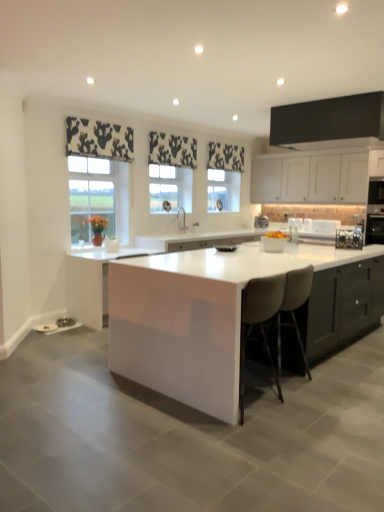
Locate an element on the screen. The width and height of the screenshot is (384, 512). black floral fabric at upper center, acting as the second curtain starting from the left is located at coordinates (172, 150).

Find the location of a particular element. The image size is (384, 512). white matte cabinet at upper right, marked as the second cabinetry in a top-to-bottom arrangement is located at coordinates (310, 178).

Describe the element at coordinates (310, 178) in the screenshot. I see `white matte cabinet at upper right, which appears as the 3th cabinetry when viewed from the front` at that location.

Describe the element at coordinates (294, 308) in the screenshot. Image resolution: width=384 pixels, height=512 pixels. I see `beige fabric stool at center` at that location.

Locate an element on the screen. clear glass window at center, the first window positioned from the right is located at coordinates (223, 191).

This screenshot has width=384, height=512. What do you see at coordinates (223, 191) in the screenshot?
I see `clear glass window at center, which is the 2th window from left to right` at bounding box center [223, 191].

Find the location of a particular element. The image size is (384, 512). white glossy coffee machine at center is located at coordinates (261, 221).

Is white glossy cabinet at center, which is the 3th cabinetry from top to bottom, positioned far away from white matte cabinet at upper right, which is the 2th cabinetry from bottom to top?

white glossy cabinet at center, which is the 3th cabinetry from top to bottom, is far away from white matte cabinet at upper right, which is the 2th cabinetry from bottom to top.

Who is smaller, white glossy cabinet at center, positioned as the third cabinetry in right-to-left order, or white matte cabinet at upper right, arranged as the first cabinetry when viewed from the right?

white glossy cabinet at center, positioned as the third cabinetry in right-to-left order, is smaller.

Considering the sizes of objects white glossy cabinet at center, which ranks as the first cabinetry in bottom-to-top order, and white matte cabinet at upper right, which appears as the third cabinetry when viewed from the left, in the image provided, who is thinner, white glossy cabinet at center, which ranks as the first cabinetry in bottom-to-top order, or white matte cabinet at upper right, which appears as the third cabinetry when viewed from the left,?

white matte cabinet at upper right, which appears as the third cabinetry when viewed from the left.

You are a GUI agent. You are given a task and a screenshot of the screen. Output one action in this format:
    pyautogui.click(x=<x>, y=<y>)
    Task: Click on the 1st cabinetry directly above the white glossy cabinet at center, which is the second cabinetry from back to front (from a real-world perspective)
    The image size is (384, 512).
    Given the screenshot: What is the action you would take?
    pyautogui.click(x=310, y=178)

Visually, is white glossy bowl at center positioned to the left or to the right of white glossy table at center?

white glossy bowl at center is positioned on white glossy table at center's left side.

Is white glossy bowl at center looking in the opposite direction of white glossy table at center?

That's not correct — white glossy bowl at center is not looking away from white glossy table at center.

Looking at this image, measure the distance from white glossy bowl at center to white glossy table at center.

white glossy bowl at center and white glossy table at center are 9.43 feet apart from each other.

Which of these two, white glossy bowl at center or white glossy table at center, is smaller?

With smaller size is white glossy bowl at center.

Between black stainless steel oven at right, acting as the 1th appliance starting from the back, and black glossy pan at center, the 3th appliance from the right, which one appears on the right side from the viewer's perspective?

Positioned to the right is black stainless steel oven at right, acting as the 1th appliance starting from the back.

Can you confirm if black stainless steel oven at right, acting as the 1th appliance starting from the back, is thinner than black glossy pan at center, which ranks as the third appliance in back-to-front order?

Incorrect, the width of black stainless steel oven at right, acting as the 1th appliance starting from the back, is not less than that of black glossy pan at center, which ranks as the third appliance in back-to-front order.

How far apart are black stainless steel oven at right, arranged as the third appliance when viewed from the left, and black glossy pan at center, the first appliance from the front?

black stainless steel oven at right, arranged as the third appliance when viewed from the left, is 5.91 feet from black glossy pan at center, the first appliance from the front.

Who is shorter, black stainless steel oven at right, the 3th appliance when ordered from front to back, or black glossy pan at center, the first appliance from the front?

Standing shorter between the two is black glossy pan at center, the first appliance from the front.

How different are the orientations of white glossy sink at center and white matte cabinet at upper right, marked as the first cabinetry in a back-to-front arrangement, in degrees?

92.9 degrees.

Which object is more forward, white glossy sink at center or white matte cabinet at upper right, which appears as the third cabinetry when viewed from the left?

white glossy sink at center.

Which is more to the right, white glossy sink at center or white matte cabinet at upper right, marked as the first cabinetry in a back-to-front arrangement?

white matte cabinet at upper right, marked as the first cabinetry in a back-to-front arrangement.

Can white matte cabinet at upper right, arranged as the first cabinetry when viewed from the right, be found inside white glossy sink at center?

No, white glossy sink at center does not contain white matte cabinet at upper right, arranged as the first cabinetry when viewed from the right.

Is white matte cabinet at upper right, marked as the second cabinetry in a top-to-bottom arrangement, placed right next to black floral fabric at upper center, positioned as the 2th curtain in back-to-front order?

They are not placed beside each other.

Considering the relative sizes of white matte cabinet at upper right, marked as the first cabinetry in a back-to-front arrangement, and black floral fabric at upper center, marked as the second curtain in a right-to-left arrangement, in the image provided, is white matte cabinet at upper right, marked as the first cabinetry in a back-to-front arrangement, shorter than black floral fabric at upper center, marked as the second curtain in a right-to-left arrangement,?

No.

How many degrees apart are the facing directions of white matte cabinet at upper right, arranged as the first cabinetry when viewed from the right, and black floral fabric at upper center, which is the second curtain in front-to-back order?

They differ by 89.3 degrees in their facing directions.

In the image, there is a clear glass window at center, the first window positioned from the back. Where is `sink below it (from a real-world perspective)`? sink below it (from a real-world perspective) is located at coordinates (183, 220).

Who is taller, clear glass window at center, the 2th window positioned from the front, or white glossy sink at center?

Standing taller between the two is clear glass window at center, the 2th window positioned from the front.

Between clear glass window at center, the 2th window positioned from the front, and white glossy sink at center, which one is positioned in front?

white glossy sink at center is closer to the camera.

From a real-world perspective, which object stands above the other?

From a 3D spatial view, clear glass window at center, which is the 2th window from left to right, is above.

Could you tell me if black printed fabric at upper center, which appears as the first curtain when viewed from the back, is turned towards black and white fabric at upper left, the third curtain when ordered from right to left?

No, black printed fabric at upper center, which appears as the first curtain when viewed from the back, is not aimed at black and white fabric at upper left, the third curtain when ordered from right to left.

From the image's perspective, is black printed fabric at upper center, the 3th curtain in the left-to-right sequence, below black and white fabric at upper left, the first curtain when ordered from front to back?

Incorrect, from the image's perspective, black printed fabric at upper center, the 3th curtain in the left-to-right sequence, is higher than black and white fabric at upper left, the first curtain when ordered from front to back.

Can you confirm if black printed fabric at upper center, marked as the first curtain in a right-to-left arrangement, is positioned to the right of black and white fabric at upper left, the third curtain when ordered from right to left?

Indeed, black printed fabric at upper center, marked as the first curtain in a right-to-left arrangement, is positioned on the right side of black and white fabric at upper left, the third curtain when ordered from right to left.

Based on the photo, choose the correct answer: Is black printed fabric at upper center, which appears as the first curtain when viewed from the back, inside black and white fabric at upper left, positioned as the first curtain in left-to-right order, or outside it?

black printed fabric at upper center, which appears as the first curtain when viewed from the back, is not inside black and white fabric at upper left, positioned as the first curtain in left-to-right order, it's outside.

Where is `cabinetry that appears below the white matte cabinet at upper right, which appears as the 3th cabinetry when viewed from the front (from the image's perspective)`? cabinetry that appears below the white matte cabinet at upper right, which appears as the 3th cabinetry when viewed from the front (from the image's perspective) is located at coordinates (92, 282).

Locate an element on the screen. The height and width of the screenshot is (512, 384). table lying on the right of white glossy bowl at center is located at coordinates (193, 317).

Based on their spatial positions, is black matte cabinet at upper center, which is counted as the third cabinetry, starting from the back, or white glossy sink at center closer to black glossy pan at center, the first appliance positioned from the left?

white glossy sink at center lies closer to black glossy pan at center, the first appliance positioned from the left, than the other object.

When comparing their distances from clear glass window at center, the 1th window positioned from the left, does black matte cabinet at upper center, the 2th cabinetry positioned from the left, or metallic silver toaster at center, which is the second appliance from back to front, seem closer?

Based on the image, black matte cabinet at upper center, the 2th cabinetry positioned from the left, appears to be nearer to clear glass window at center, the 1th window positioned from the left.

From the image, which object appears to be nearer to black glossy pan at center, which ranks as the third appliance in back-to-front order, beige fabric stool at center or black and white fabric at upper left, the 3th curtain when ordered from back to front?

Based on the image, beige fabric stool at center appears to be nearer to black glossy pan at center, which ranks as the third appliance in back-to-front order.

Estimate the real-world distances between objects in this image. Which object is further from beige fabric stool at center, white glossy coffee machine at center or black matte cabinet at upper center, the 2th cabinetry positioned from the left?

Among the two, white glossy coffee machine at center is located further to beige fabric stool at center.

From the image, which object appears to be farther from beige fabric stool at center, black stainless steel oven at right, placed as the first appliance when sorted from right to left, or black printed fabric at upper center, which is the third curtain in front-to-back order?

black printed fabric at upper center, which is the third curtain in front-to-back order.

Which object lies nearer to the anchor point white matte cabinet at upper right, arranged as the first cabinetry when viewed from the right, black glossy pan at center, the first appliance from the front, or black stainless steel oven at right, placed as the first appliance when sorted from right to left?

black stainless steel oven at right, placed as the first appliance when sorted from right to left.

Looking at this image, looking at the image, which one is located further to black and white fabric at upper left, positioned as the first curtain in left-to-right order, white glossy cabinet at center, positioned as the 2th cabinetry in front-to-back order, or white glossy table at center?

Based on the image, white glossy table at center appears to be further to black and white fabric at upper left, positioned as the first curtain in left-to-right order.

Considering their positions, is beige fabric stool at center positioned further to clear glass window at center, the first window positioned from the back, than black glossy pan at center, the first appliance from the front?

beige fabric stool at center is positioned further to the anchor clear glass window at center, the first window positioned from the back.

I want to click on curtain between black floral fabric at upper center, marked as the second curtain in a right-to-left arrangement, and black glossy pan at center, the first appliance from the front, vertically, so click(x=99, y=140).

I want to click on sink between white glossy bowl at center and white matte cabinet at upper right, marked as the second cabinetry in a top-to-bottom arrangement, along the z-axis, so click(183, 220).

Locate an element on the screen. The width and height of the screenshot is (384, 512). cabinetry located between black floral fabric at upper center, positioned as the 2th curtain in back-to-front order, and white matte cabinet at upper right, arranged as the first cabinetry when viewed from the right, in the left-right direction is located at coordinates (328, 119).

Where is `curtain located between clear glass window at center, which is counted as the second window, starting from the back, and black printed fabric at upper center, marked as the first curtain in a right-to-left arrangement, in the left-right direction`? curtain located between clear glass window at center, which is counted as the second window, starting from the back, and black printed fabric at upper center, marked as the first curtain in a right-to-left arrangement, in the left-right direction is located at coordinates (172, 150).